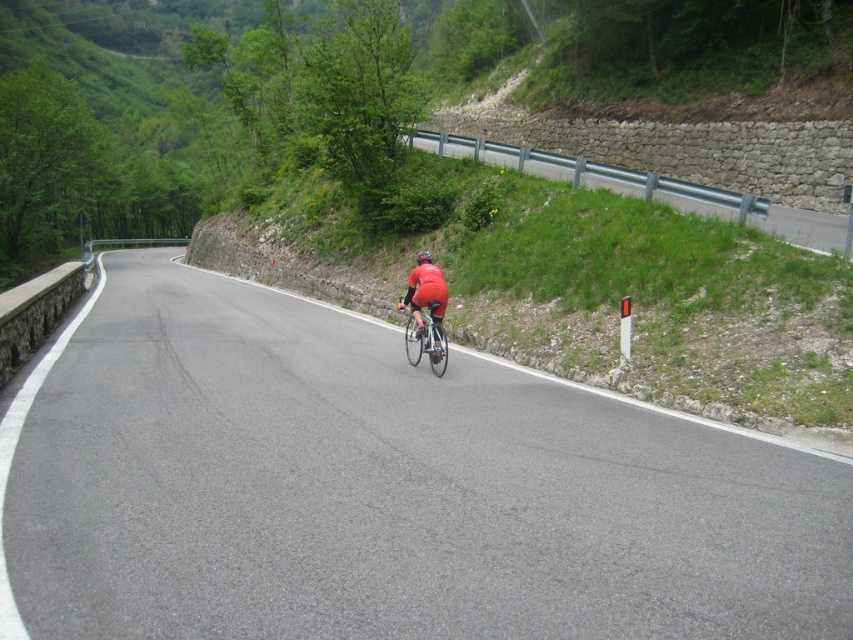
Question: Which is farther from the matte red helmet at center?

Choices:
 (A) asphalt road at center
 (B) shiny metallic bicycle at center

Answer: (A)

Question: Which of the following is the closest to the observer?

Choices:
 (A) (438, 337)
 (B) (433, 339)

Answer: (A)

Question: Which point appears farthest from the camera in this image?

Choices:
 (A) (805, 609)
 (B) (433, 320)
 (C) (428, 260)
 (D) (431, 356)

Answer: (C)

Question: Is asphalt road at center wider than shiny metallic bicycle at center?

Choices:
 (A) no
 (B) yes

Answer: (B)

Question: Can you confirm if shiny metallic bicycle at center is bigger than matte red helmet at center?

Choices:
 (A) no
 (B) yes

Answer: (A)

Question: Is matte red cycling suit at center above matte red helmet at center?

Choices:
 (A) no
 (B) yes

Answer: (A)